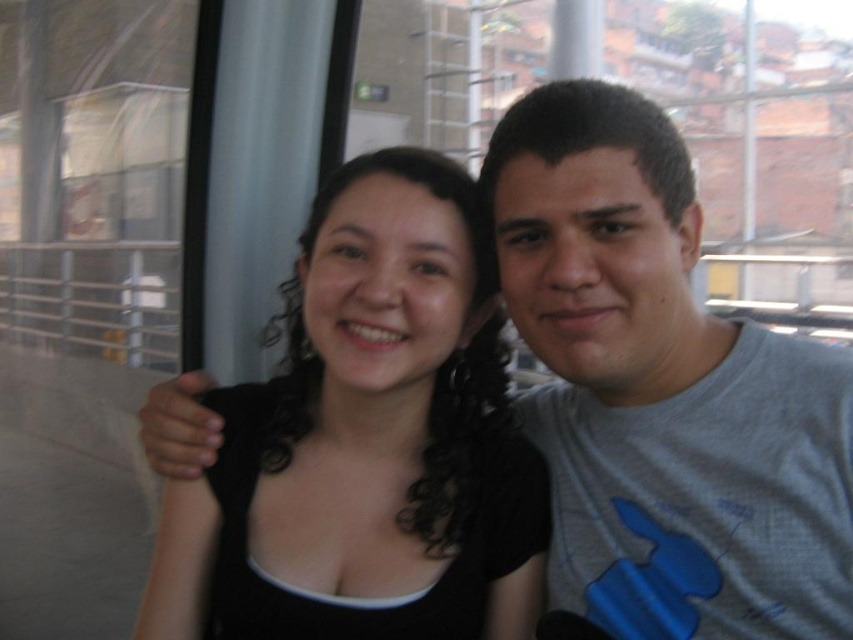
Can you confirm if gray cotton t-shirt at right is taller than black matte hair at center?

Indeed, gray cotton t-shirt at right has a greater height compared to black matte hair at center.

Which of these two, gray cotton t-shirt at right or black matte hair at center, stands taller?

With more height is gray cotton t-shirt at right.

This screenshot has width=853, height=640. Describe the element at coordinates (662, 392) in the screenshot. I see `gray cotton t-shirt at right` at that location.

Where is `gray cotton t-shirt at right`? The height and width of the screenshot is (640, 853). gray cotton t-shirt at right is located at coordinates (662, 392).